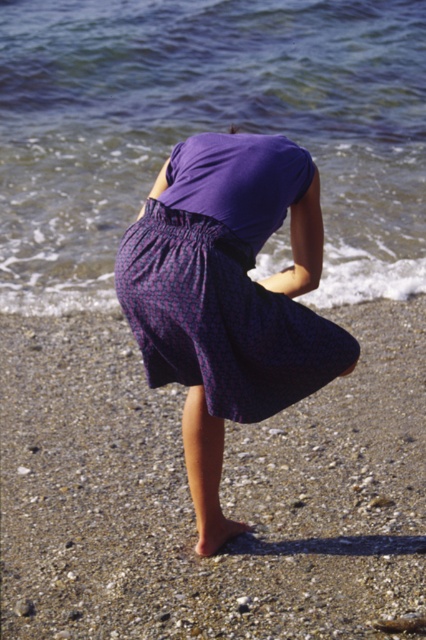
Question: Does clear water at lower left have a larger size compared to purple woven skirt at center?

Choices:
 (A) no
 (B) yes

Answer: (B)

Question: Which of the following is the farthest from the observer?

Choices:
 (A) (290, 310)
 (B) (114, 97)

Answer: (B)

Question: Which object appears closest to the camera in this image?

Choices:
 (A) smooth pebbled sand at lower center
 (B) purple woven skirt at center
 (C) clear water at lower left

Answer: (A)

Question: Observing the image, what is the correct spatial positioning of smooth pebbled sand at lower center in reference to purple woven skirt at center?

Choices:
 (A) left
 (B) right

Answer: (A)

Question: Which point is farther to the camera?

Choices:
 (A) clear water at lower left
 (B) smooth pebbled sand at lower center

Answer: (A)

Question: Observing the image, what is the correct spatial positioning of smooth pebbled sand at lower center in reference to clear water at lower left?

Choices:
 (A) above
 (B) below

Answer: (B)